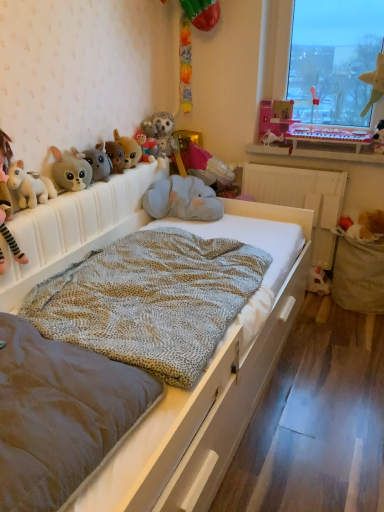
Question: Does point (160, 120) appear closer or farther from the camera than point (97, 168)?

Choices:
 (A) farther
 (B) closer

Answer: (A)

Question: Considering the positions of fluffy gray owl at center, acting as the 8th toy starting from the right, and fluffy gray plush at upper left, which is the 11th toy from right to left, in the image, is fluffy gray owl at center, acting as the 8th toy starting from the right, taller or shorter than fluffy gray plush at upper left, which is the 11th toy from right to left,?

Choices:
 (A) short
 (B) tall

Answer: (B)

Question: Which is nearer to the velvet plush elephant at center, placed as the sixth toy when sorted from right to left?

Choices:
 (A) velvet grey mattress at center
 (B) matte plush rabbit at left, marked as the twelfth toy in a right-to-left arrangement
 (C) white plastic keyboard at upper right
 (D) white plush unicorn at left, which is the 1th toy from left to right
 (E) textured beige blanket at center

Answer: (C)

Question: Which object is positioned farthest from the velvet plush elephant at center, which is the eighth toy in left-to-right order?

Choices:
 (A) matte plush rabbit at left, arranged as the 2th toy when viewed from the left
 (B) white plastic keyboard at upper right
 (C) white wooden bed at center
 (D) velvet grey mattress at center
 (E) transparent glass window at upper right

Answer: (D)